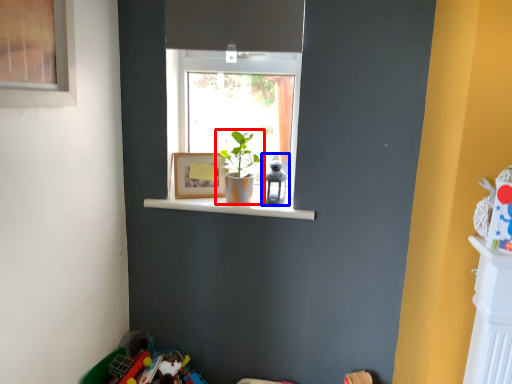
Question: Which object is closer to the camera taking this photo, houseplant (highlighted by a red box) or toy (highlighted by a blue box)?

Choices:
 (A) houseplant
 (B) toy

Answer: (A)